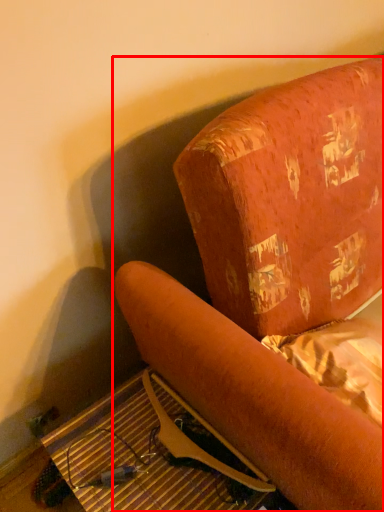
Question: From the image's perspective, what is the correct spatial relationship of furniture (annotated by the red box) in relation to table?

Choices:
 (A) above
 (B) below

Answer: (A)